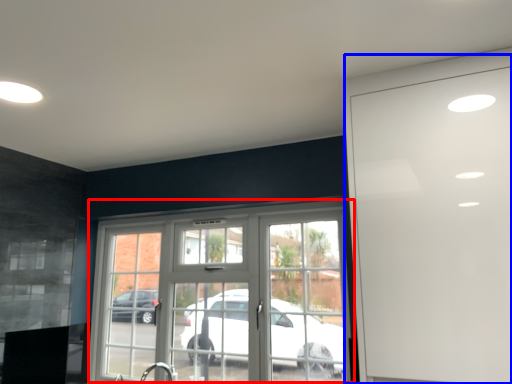
Question: Which of the following is the closest to the observer, window (highlighted by a red box) or garage door (highlighted by a blue box)?

Choices:
 (A) window
 (B) garage door

Answer: (B)